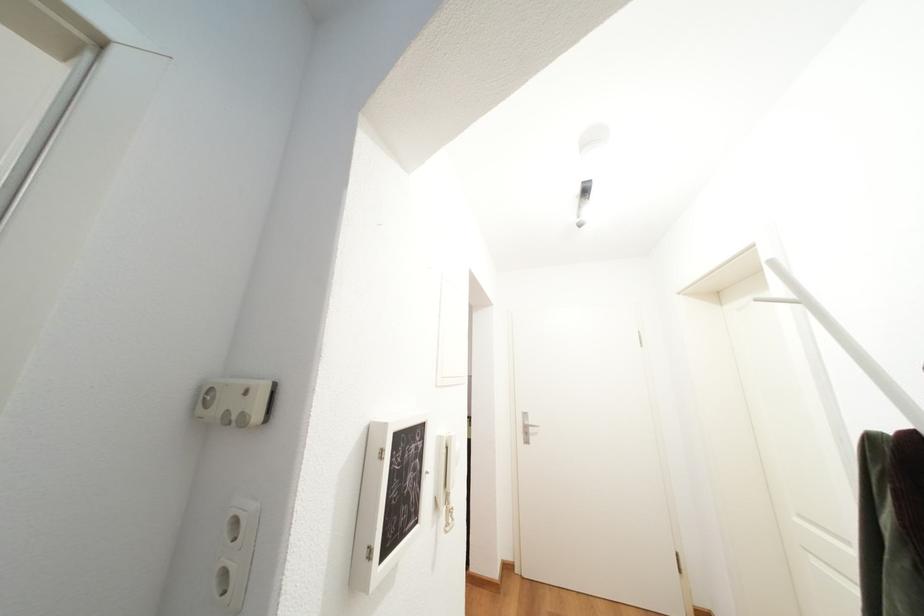
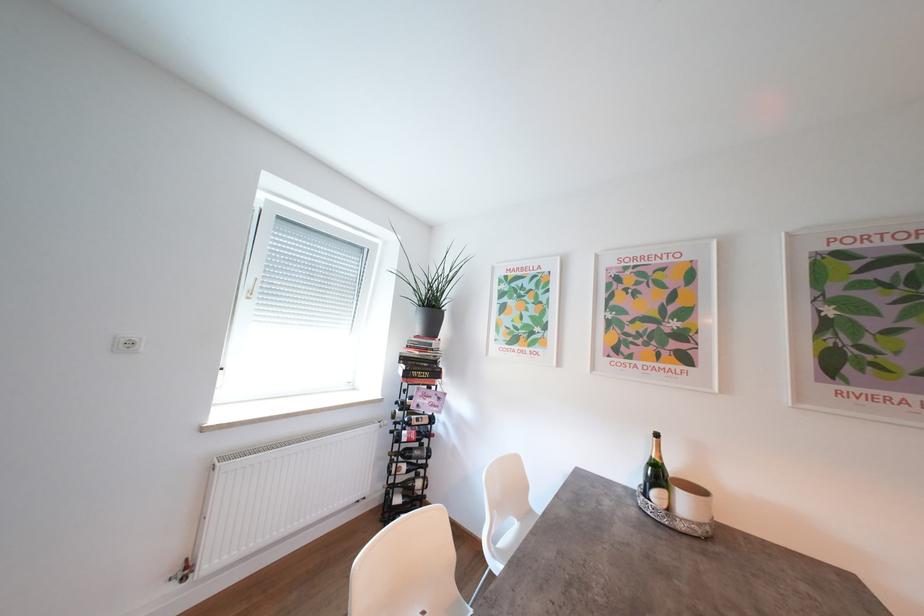
In a continuous first-person perspective shot, in which direction is the camera moving?

The movement direction of the cameraman is left, forward.